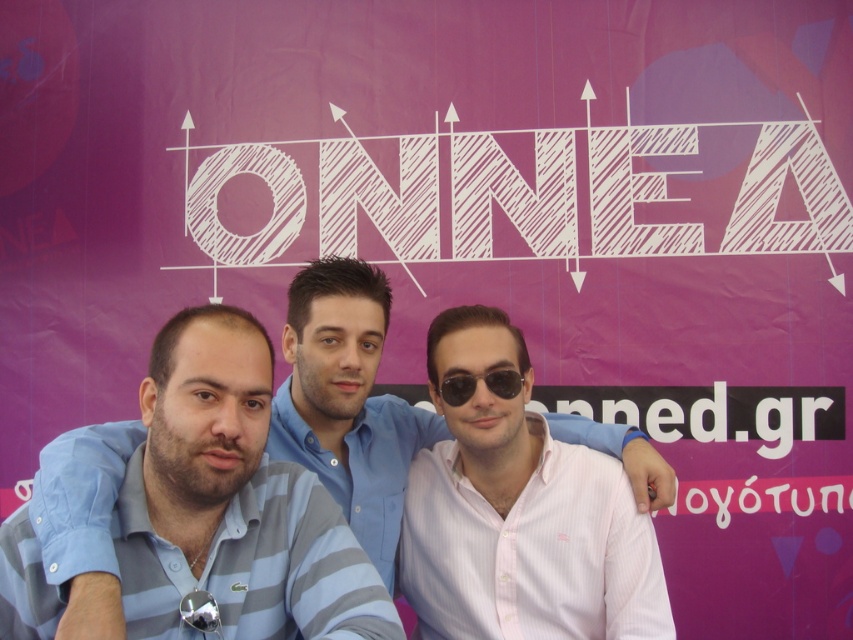
From the picture: You are a photographer who just took a photo of two people in front of a purple backdrop. You need to describe the spatial relationship between the blue striped polo shirt at center and the black plastic sunglasses at center. Which one is positioned to the left?

The blue striped polo shirt at center is positioned to the left of the black plastic sunglasses at center.

You are a photographer setting up for a group photo. You notice the pink striped shirt at center and the black plastic sunglasses at center. Which item is positioned lower relative to the other?

The pink striped shirt at center is positioned below the black plastic sunglasses at center, so it is lower.